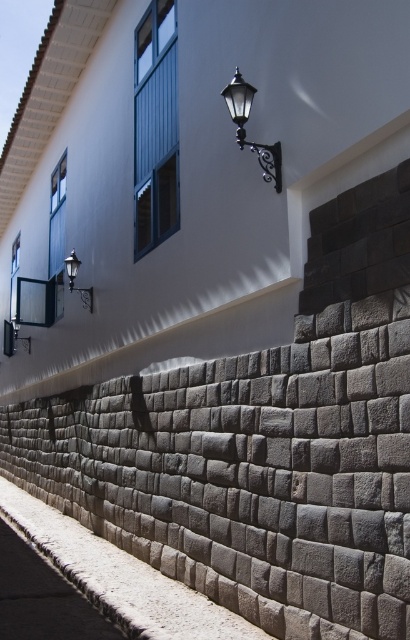
Question: Can you confirm if polished brass lantern at upper center is bigger than matte black wall sconce at upper left?

Choices:
 (A) no
 (B) yes

Answer: (A)

Question: Is gray stone pavement at lower left thinner than polished brass lantern at upper center?

Choices:
 (A) no
 (B) yes

Answer: (A)

Question: Based on their relative distances, which object is farther from the polished brass lantern at upper center?

Choices:
 (A) matte black wall sconce at upper left
 (B) matte black lamp at upper left
 (C) gray stone pavement at lower left

Answer: (A)

Question: Can you confirm if matte black lamp at upper left is positioned to the right of matte black wall sconce at upper left?

Choices:
 (A) yes
 (B) no

Answer: (A)

Question: Which point is farther to the camera?

Choices:
 (A) matte black wall sconce at upper left
 (B) matte black lamp at upper left

Answer: (A)

Question: Which point is farther to the camera?

Choices:
 (A) matte black lamp at upper left
 (B) gray stone pavement at lower left
 (C) polished brass lantern at upper center

Answer: (A)